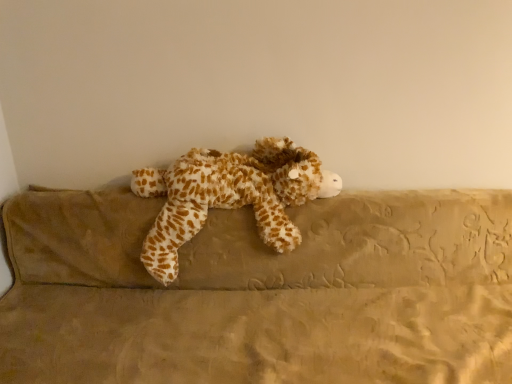
The width and height of the screenshot is (512, 384). What do you see at coordinates (261, 292) in the screenshot?
I see `brown plush couch at center` at bounding box center [261, 292].

Where is `brown plush couch at center`? brown plush couch at center is located at coordinates (261, 292).

Describe the element at coordinates (229, 196) in the screenshot. The image size is (512, 384). I see `fuzzy brown and white stuffed animal at center` at that location.

Find the location of a particular element. fuzzy brown and white stuffed animal at center is located at coordinates (229, 196).

This screenshot has width=512, height=384. Identify the location of brown plush couch at center. pos(261,292).

Based on their positions, is brown plush couch at center located to the left or right of fuzzy brown and white stuffed animal at center?

In the image, brown plush couch at center appears on the right side of fuzzy brown and white stuffed animal at center.

Is brown plush couch at center in front of or behind fuzzy brown and white stuffed animal at center in the image?

brown plush couch at center is positioned closer to the viewer than fuzzy brown and white stuffed animal at center.

Considering the positions of points (487, 219) and (268, 184), is point (487, 219) farther from camera compared to point (268, 184)?

Yes, it is behind point (268, 184).

From the image's perspective, is brown plush couch at center under fuzzy brown and white stuffed animal at center?

Yes.

From a real-world perspective, which is physically above, brown plush couch at center or fuzzy brown and white stuffed animal at center?

fuzzy brown and white stuffed animal at center, from a real-world perspective.

Which of these two, brown plush couch at center or fuzzy brown and white stuffed animal at center, is wider?

brown plush couch at center.

Who is taller, brown plush couch at center or fuzzy brown and white stuffed animal at center?

Standing taller between the two is brown plush couch at center.

Does brown plush couch at center have a larger size compared to fuzzy brown and white stuffed animal at center?

Correct, brown plush couch at center is larger in size than fuzzy brown and white stuffed animal at center.

Is brown plush couch at center inside or outside of fuzzy brown and white stuffed animal at center?

brown plush couch at center is not inside fuzzy brown and white stuffed animal at center, it's outside.

Is there a large distance between brown plush couch at center and fuzzy brown and white stuffed animal at center?

brown plush couch at center is actually quite close to fuzzy brown and white stuffed animal at center.

Is brown plush couch at center oriented away from fuzzy brown and white stuffed animal at center?

Yes, brown plush couch at center is positioned with its back facing fuzzy brown and white stuffed animal at center.

Identify the location of couch in front of the fuzzy brown and white stuffed animal at center. The height and width of the screenshot is (384, 512). tap(261, 292).

Considering the positions of objects fuzzy brown and white stuffed animal at center and brown plush couch at center in the image provided, who is more to the left, fuzzy brown and white stuffed animal at center or brown plush couch at center?

fuzzy brown and white stuffed animal at center.

Which is behind, fuzzy brown and white stuffed animal at center or brown plush couch at center?

fuzzy brown and white stuffed animal at center is more distant.

Is point (182, 192) farther from camera compared to point (101, 201)?

That is False.

From the image's perspective, does fuzzy brown and white stuffed animal at center appear higher than brown plush couch at center?

Yes.

From a real-world perspective, is fuzzy brown and white stuffed animal at center under brown plush couch at center?

Incorrect, from a real-world perspective, fuzzy brown and white stuffed animal at center is higher than brown plush couch at center.

Looking at their sizes, would you say fuzzy brown and white stuffed animal at center is wider or thinner than brown plush couch at center?

fuzzy brown and white stuffed animal at center is thinner than brown plush couch at center.

Considering the sizes of objects fuzzy brown and white stuffed animal at center and brown plush couch at center in the image provided, who is taller, fuzzy brown and white stuffed animal at center or brown plush couch at center?

brown plush couch at center.

Which of these two, fuzzy brown and white stuffed animal at center or brown plush couch at center, is bigger?

brown plush couch at center.

Is fuzzy brown and white stuffed animal at center not inside brown plush couch at center?

No, fuzzy brown and white stuffed animal at center is not outside of brown plush couch at center.

Is fuzzy brown and white stuffed animal at center next to brown plush couch at center?

No, fuzzy brown and white stuffed animal at center is not beside brown plush couch at center.

Is fuzzy brown and white stuffed animal at center aimed at brown plush couch at center?

Yes, fuzzy brown and white stuffed animal at center faces towards brown plush couch at center.

How many degrees apart are the facing directions of fuzzy brown and white stuffed animal at center and brown plush couch at center?

fuzzy brown and white stuffed animal at center and brown plush couch at center are facing 1.03 degrees away from each other.

Where is `couch on the right of the fuzzy brown and white stuffed animal at center`? This screenshot has height=384, width=512. couch on the right of the fuzzy brown and white stuffed animal at center is located at coordinates 261,292.

I want to click on toy behind the brown plush couch at center, so click(x=229, y=196).

Locate an element on the screen. The image size is (512, 384). couch below the fuzzy brown and white stuffed animal at center (from a real-world perspective) is located at coordinates (261, 292).